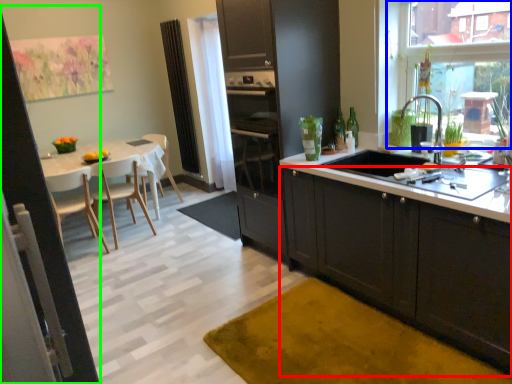
Question: Considering the real-world distances, which object is closest to cabinetry (highlighted by a red box)? window screen (highlighted by a blue box) or screen door (highlighted by a green box).

Choices:
 (A) window screen
 (B) screen door

Answer: (A)